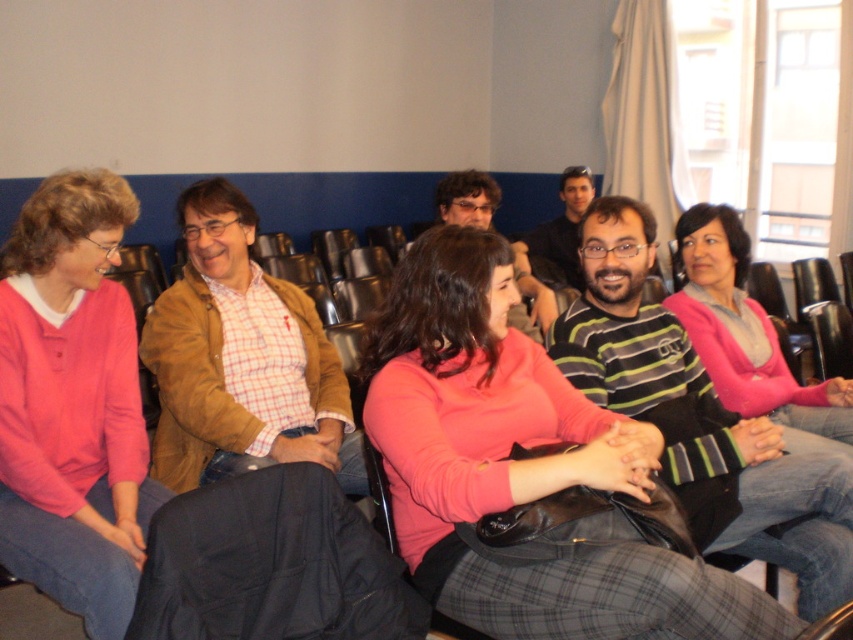
Question: Where is pink matte sweater at center located in relation to matte black shirt at center in the image?

Choices:
 (A) right
 (B) left

Answer: (B)

Question: Among these objects, which one is farthest from the camera?

Choices:
 (A) pink matte sweater at center
 (B) pink sweater at left

Answer: (B)

Question: Can you confirm if brown leather jacket at center is thinner than matte black shirt at center?

Choices:
 (A) yes
 (B) no

Answer: (B)

Question: In this image, where is black fabric jacket at lower center located relative to matte black shirt at center?

Choices:
 (A) above
 (B) below

Answer: (B)

Question: Which point appears closest to the camera in this image?

Choices:
 (A) (705, 317)
 (B) (463, 188)

Answer: (A)

Question: Which is farther from the pink matte sweater at center?

Choices:
 (A) black fabric jacket at lower center
 (B) matte black shirt at center
 (C) pink sweater at left
 (D) brown leather jacket at center

Answer: (B)